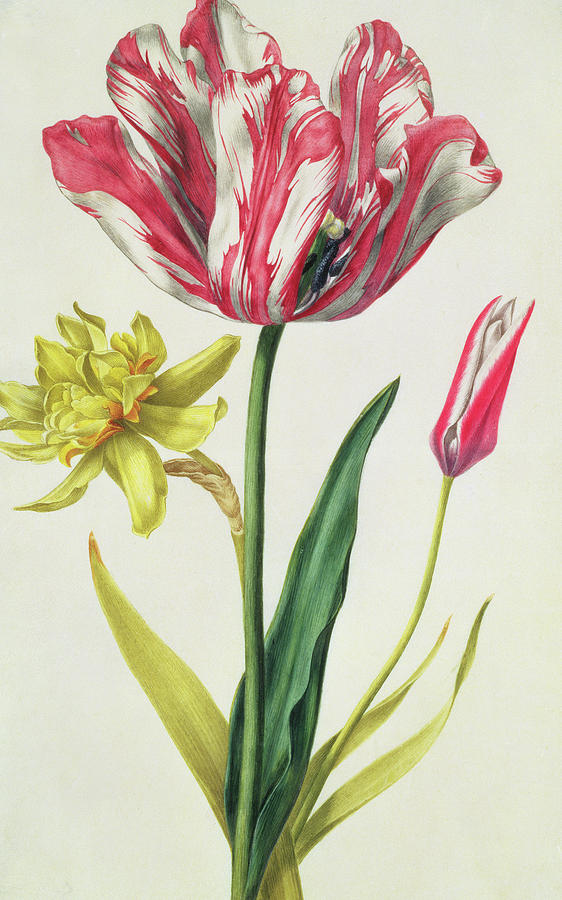
Locate an element on the screen. artwork: daffodil and tulipdaffodil and tulip, c.1675 is located at coordinates click(329, 276).